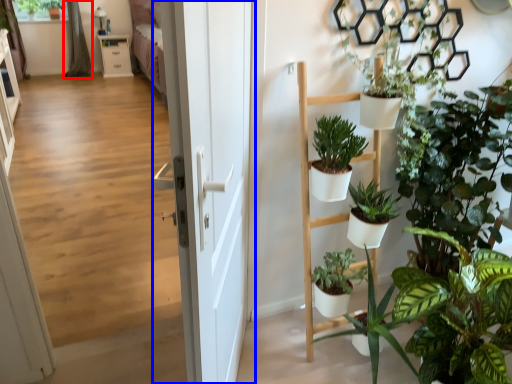
Question: Which point is further to the camera, curtain (highlighted by a red box) or door (highlighted by a blue box)?

Choices:
 (A) curtain
 (B) door

Answer: (A)